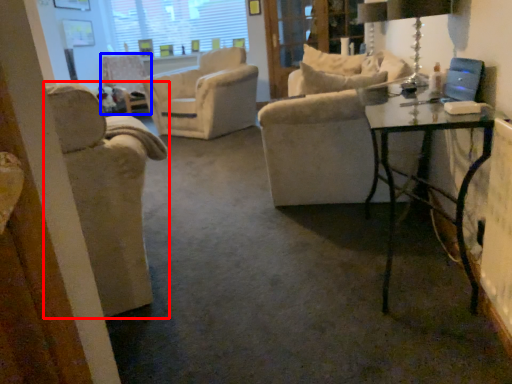
Question: Which object appears closest to the camera in this image, chair (highlighted by a red box) or chair (highlighted by a blue box)?

Choices:
 (A) chair
 (B) chair

Answer: (A)